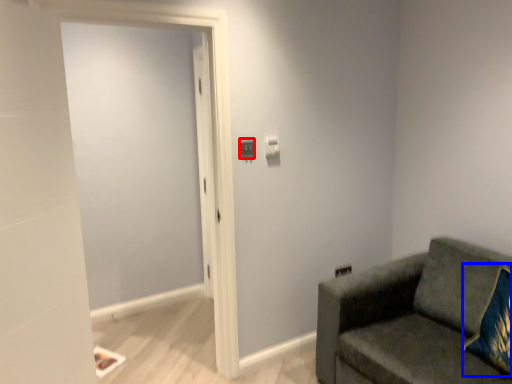
Question: Which object is closer to the camera taking this photo, light switch (highlighted by a red box) or throw pillow (highlighted by a blue box)?

Choices:
 (A) light switch
 (B) throw pillow

Answer: (B)